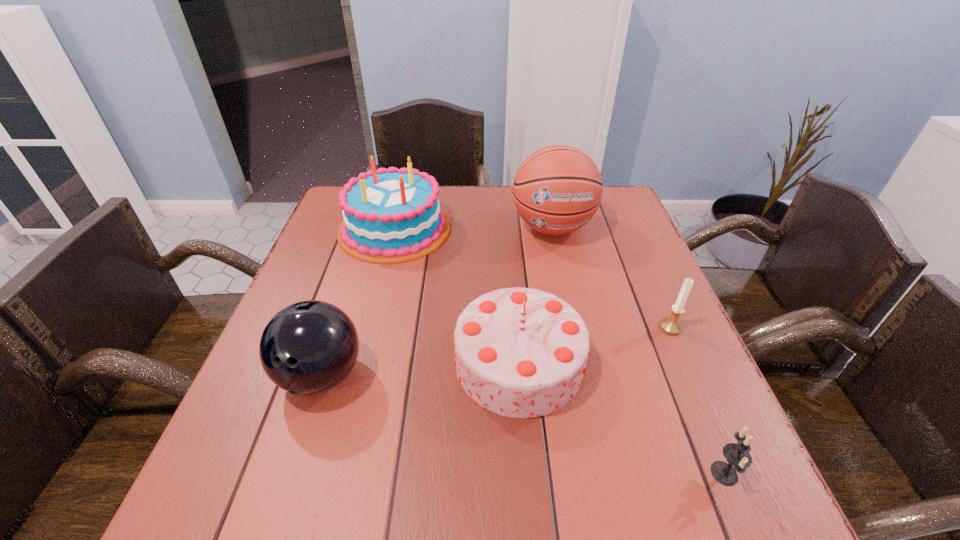
This screenshot has width=960, height=540. In order to click on free space between the bowling ball and the right birthday cake in this screenshot , I will do `click(420, 369)`.

In order to click on vacant space that is in between the nearer birthday cake and the bowling ball in this screenshot , I will do `click(420, 369)`.

Locate an element on the screen. This screenshot has width=960, height=540. free space between the taller candle holder and the nearest object is located at coordinates (698, 400).

Identify the location of vacant area that lies between the bowling ball and the tallest object. The height and width of the screenshot is (540, 960). (437, 301).

Identify the location of blank region between the bowling ball and the right birthday cake. (420, 369).

Image resolution: width=960 pixels, height=540 pixels. Find the location of `free point between the taller candle holder and the farther birthday cake`. free point between the taller candle holder and the farther birthday cake is located at coordinates (533, 278).

Locate which object ranks fourth in proximity to the bowling ball. Please provide its 2D coordinates. Your answer should be formatted as a tuple, i.e. [(x, y)], where the tuple contains the x and y coordinates of a point satisfying the conditions above.

[(737, 455)]

Choose which object is the third nearest neighbor to the tallest object. Please provide its 2D coordinates. Your answer should be formatted as a tuple, i.e. [(x, y)], where the tuple contains the x and y coordinates of a point satisfying the conditions above.

[(671, 325)]

Locate an element on the screen. This screenshot has height=540, width=960. vacant space that satisfies the following two spatial constraints: 1. on the front side of the farther candle holder; 2. on the right side of the left birthday cake is located at coordinates (371, 327).

This screenshot has height=540, width=960. I want to click on free point that satisfies the following two spatial constraints: 1. on the logo side of the shorter candle holder; 2. on the right side of the basketball, so click(606, 474).